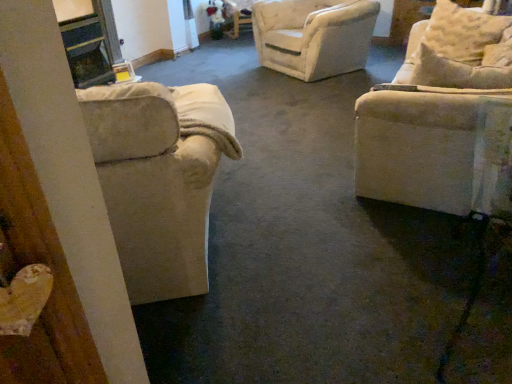
Question: In the image, is beige fabric pillow at upper right on the left side or the right side of beige fabric armchair at left, which is the first chair in left-to-right order?

Choices:
 (A) right
 (B) left

Answer: (A)

Question: From a real-world perspective, is beige fabric pillow at upper right above or below beige fabric armchair at left, which is the first chair in left-to-right order?

Choices:
 (A) above
 (B) below

Answer: (A)

Question: Which object is the closest to the beige fabric armchair at left, marked as the second chair in a right-to-left arrangement?

Choices:
 (A) beige fabric pillow at upper right
 (B) beige fabric couch at right, acting as the first chair starting from the right

Answer: (B)

Question: Based on their relative distances, which object is nearer to the beige fabric armchair at left, which is the first chair in left-to-right order?

Choices:
 (A) beige fabric couch at right, acting as the first chair starting from the right
 (B) beige fabric pillow at upper right

Answer: (A)